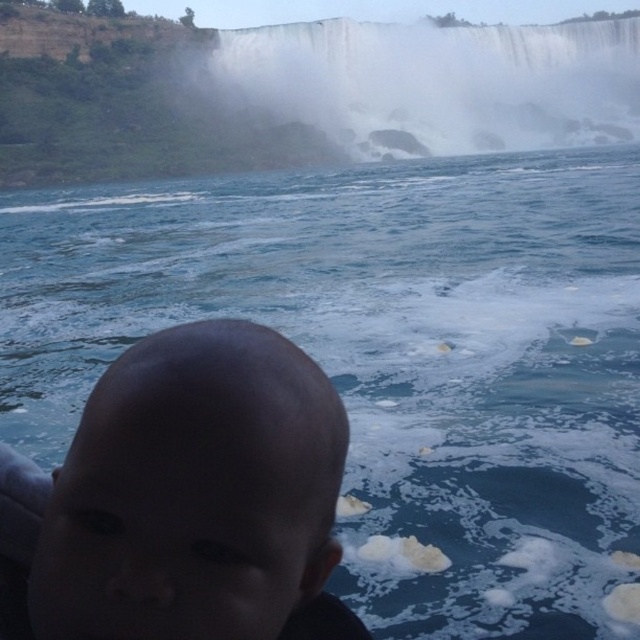
Question: Can you confirm if dark skin head at center is smaller than white misty waterfall at upper center?

Choices:
 (A) yes
 (B) no

Answer: (A)

Question: Is dark skin head at center closer to camera compared to white misty waterfall at upper center?

Choices:
 (A) no
 (B) yes

Answer: (B)

Question: Does dark skin head at center appear over white misty waterfall at upper center?

Choices:
 (A) yes
 (B) no

Answer: (B)

Question: Which point appears farthest from the camera in this image?

Choices:
 (A) (225, 36)
 (B) (154, 410)

Answer: (A)